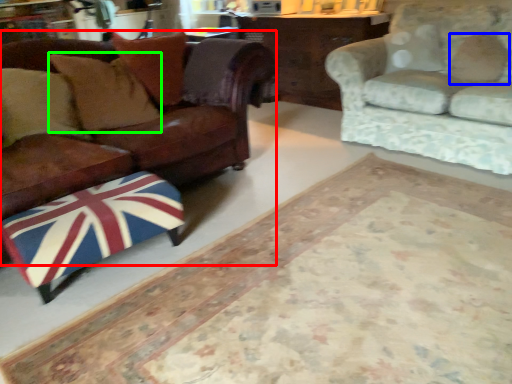
Question: Based on their relative distances, which object is nearer to studio couch (highlighted by a red box)? Choose from pillow (highlighted by a blue box) and pillow (highlighted by a green box).

Choices:
 (A) pillow
 (B) pillow

Answer: (B)